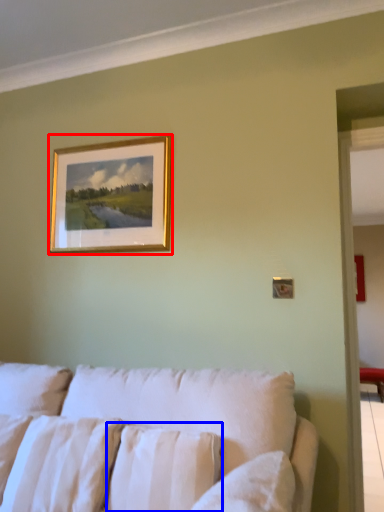
Question: Which object appears farthest to the camera in this image, picture frame (highlighted by a red box) or pillow (highlighted by a blue box)?

Choices:
 (A) picture frame
 (B) pillow

Answer: (A)